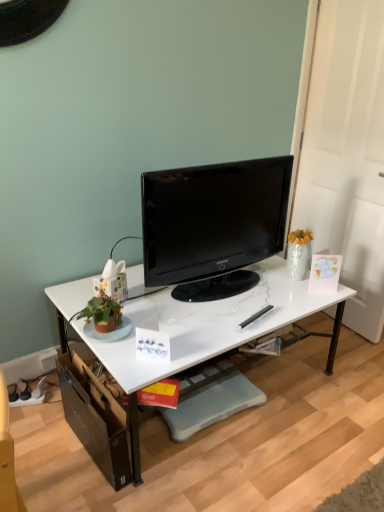
Question: Is white glossy desk at center inside black glossy tv at center?

Choices:
 (A) yes
 (B) no

Answer: (B)

Question: Is black glossy tv at center further to camera compared to white glossy desk at center?

Choices:
 (A) yes
 (B) no

Answer: (A)

Question: Considering the relative positions of black glossy tv at center and white glossy desk at center in the image provided, is black glossy tv at center in front of white glossy desk at center?

Choices:
 (A) no
 (B) yes

Answer: (A)

Question: Considering the relative positions of black glossy tv at center and white glossy desk at center in the image provided, is black glossy tv at center to the left of white glossy desk at center from the viewer's perspective?

Choices:
 (A) no
 (B) yes

Answer: (A)

Question: From the image's perspective, does black glossy tv at center appear higher than white glossy desk at center?

Choices:
 (A) yes
 (B) no

Answer: (A)

Question: From a real-world perspective, is black glossy tv at center on white glossy desk at center?

Choices:
 (A) yes
 (B) no

Answer: (A)

Question: Does white glossy desk at center come behind black glossy tv at center?

Choices:
 (A) no
 (B) yes

Answer: (A)

Question: Is white glossy desk at center placed right next to black glossy tv at center?

Choices:
 (A) yes
 (B) no

Answer: (B)

Question: Is white glossy desk at center located outside black glossy tv at center?

Choices:
 (A) yes
 (B) no

Answer: (A)

Question: Considering the relative sizes of white glossy desk at center and black glossy tv at center in the image provided, is white glossy desk at center wider than black glossy tv at center?

Choices:
 (A) no
 (B) yes

Answer: (B)

Question: Would you consider white glossy desk at center to be distant from black glossy tv at center?

Choices:
 (A) yes
 (B) no

Answer: (B)

Question: Does white glossy desk at center come in front of black glossy tv at center?

Choices:
 (A) no
 (B) yes

Answer: (B)

Question: From a real-world perspective, is black glossy tv at center above or below white glossy desk at center?

Choices:
 (A) below
 (B) above

Answer: (B)